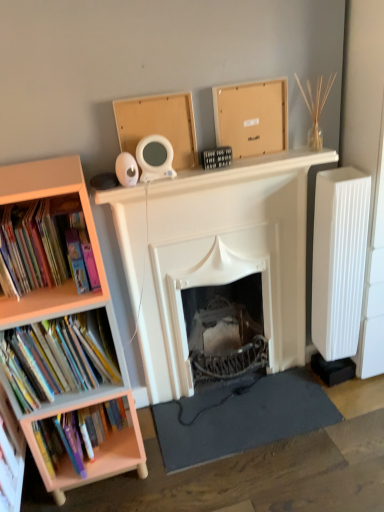
Image resolution: width=384 pixels, height=512 pixels. I want to click on vacant area that lies between white ribbed radiator at right and dark gray rubber mat at lower center, so click(335, 399).